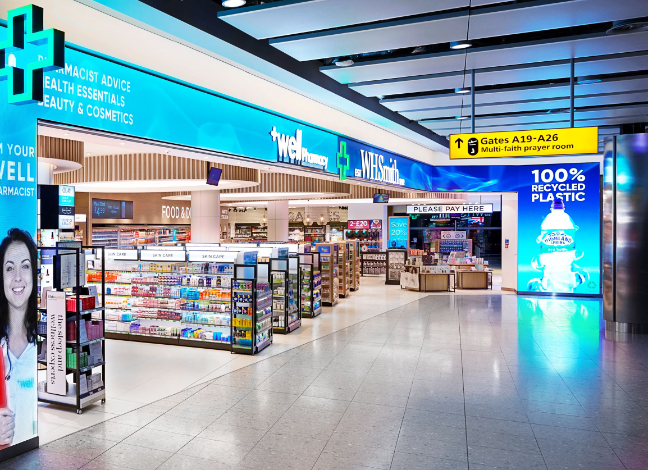
I want to click on pillar, so click(x=43, y=172), click(x=209, y=212), click(x=275, y=216).